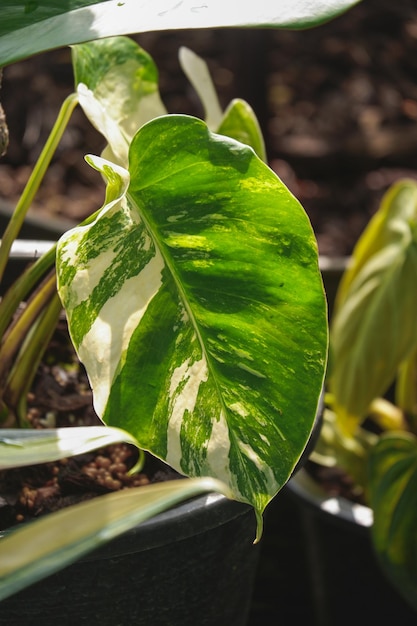
At what (x,y) coordinates should I click in order to perform the action: click on plant vases. Please return your answer as a coordinate pair (x, y). The image size is (417, 626). Looking at the image, I should click on (181, 573), (324, 551).